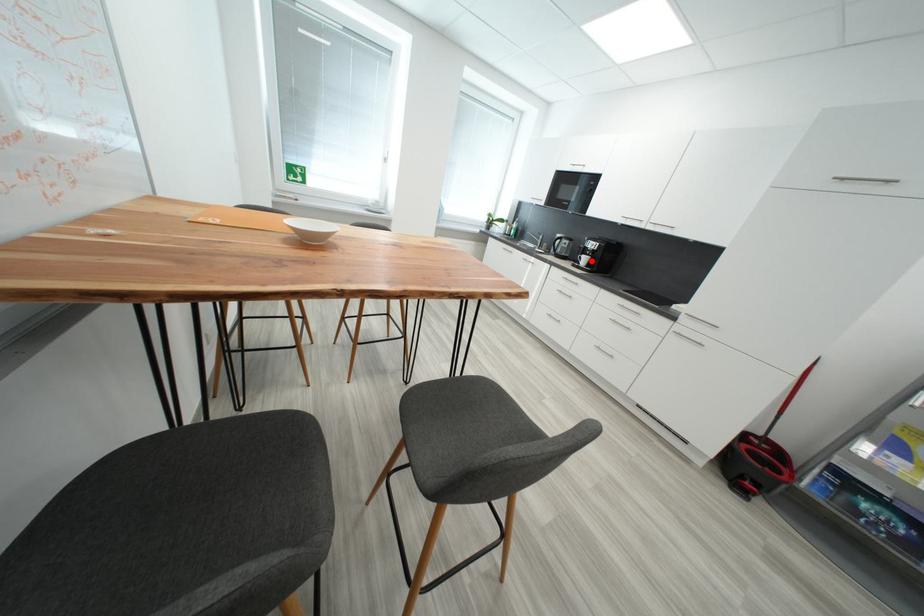
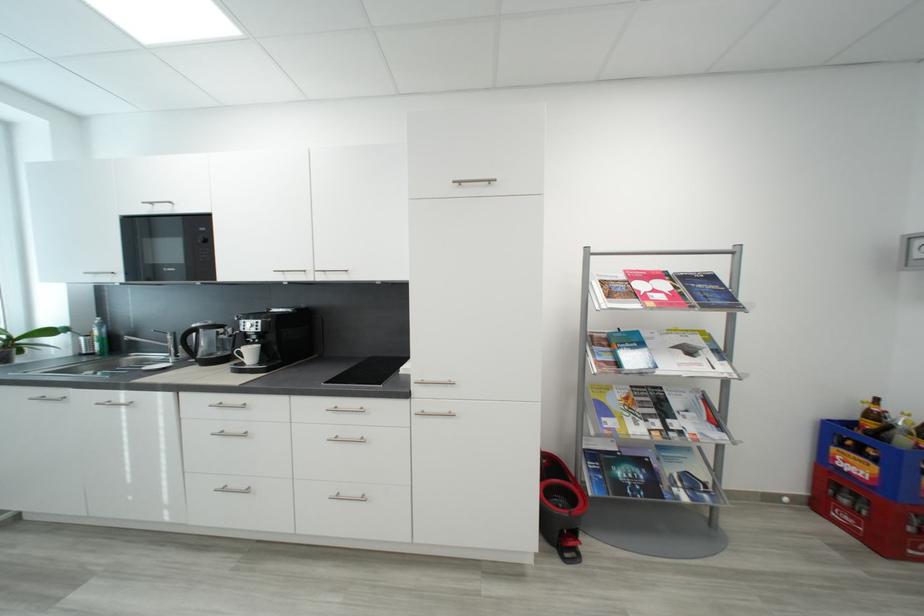
Question: I am providing you with two images of the same scene from different viewpoints. Image1 has a red point marked. In image2, the corresponding 3D location appears at what relative position? Reply with the corresponding letter.

Choices:
 (A) Closer
 (B) Farther

Answer: (B)